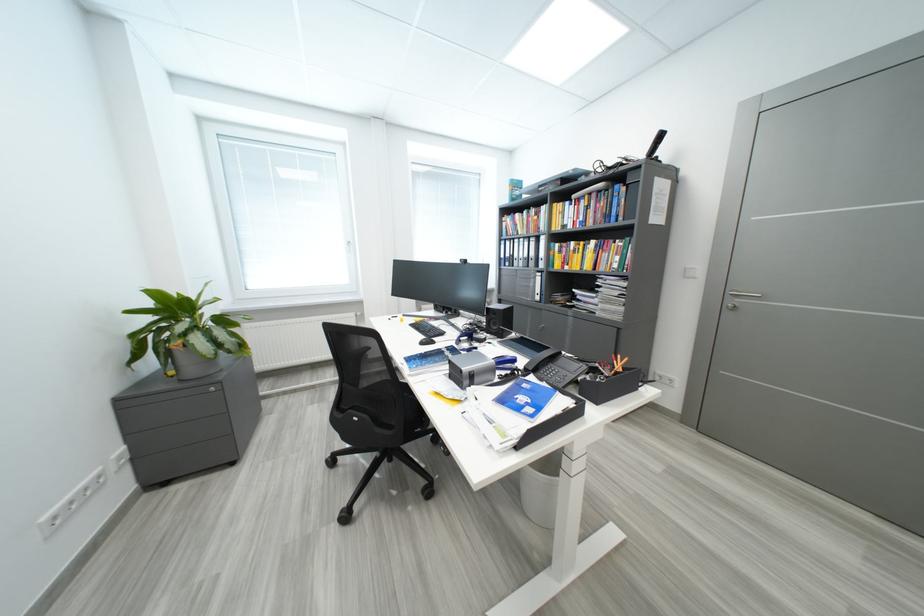
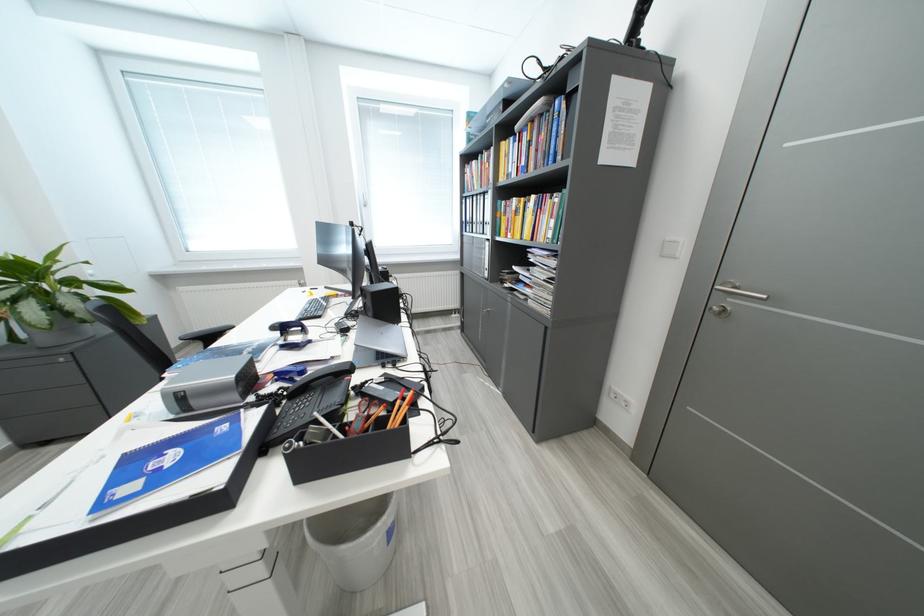
What movement of the cameraman would produce the second image?

The cameraman moved toward right, forward.